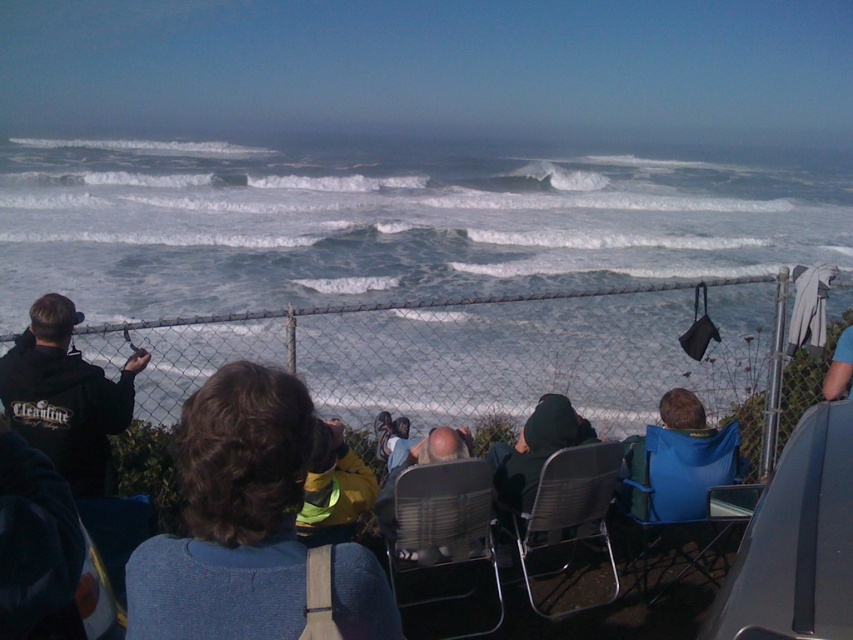
You are standing in front of the fence and want to sit down on the black mesh chair at center. Is the dark green fabric jacket at center blocking your path to the chair?

The black mesh chair at center is closer to the viewer than the dark green fabric jacket at center, so the jacket is behind the chair and not blocking the path.

You are standing at the origin point of the image coordinate system. You want to move towards the black mesh chair at center. In which direction should you move relative to your current position?

Since the black mesh chair at center is located at point (572, 506) in the 2D coordinate system, you should move towards the upper right direction from your current position at the origin to reach it.

You are a photographer setting up equipment in the scene. You need to place a large tripod between the black mesh chair at center and the dark green fabric jacket at center. Considering their sizes, will there be enough space between them to fit the tripod?

The black mesh chair at center is bigger than the dark green fabric jacket at center. Since the tripod requires space between them, and the chair is larger, there might be sufficient space depending on their exact positions, but the description only mentions size comparison, not distance between them. Without knowing the distance between the objects, it is impossible to determine if the tripod will fit.